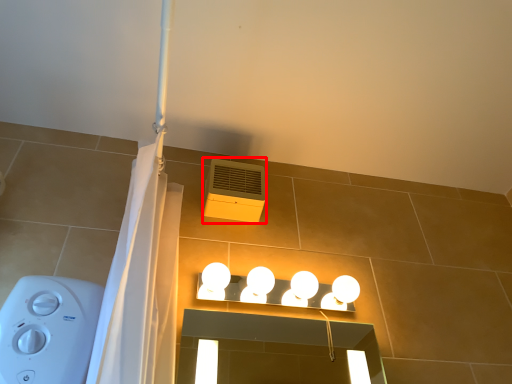
Question: From the image's perspective, considering the relative positions of air conditioning (annotated by the red box) and lamp in the image provided, where is air conditioning (annotated by the red box) located with respect to the staircase?

Choices:
 (A) above
 (B) below

Answer: (A)